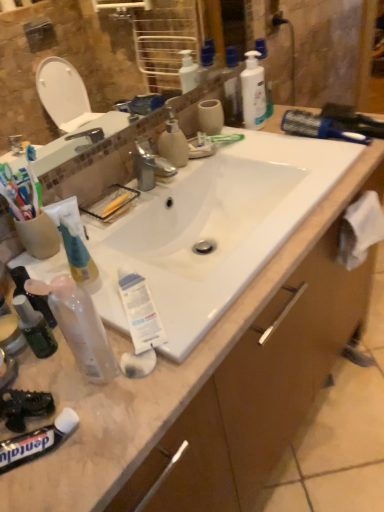
Identify the location of free point in front of transparent plastic spray bottle at lower left, positioned as the second toiletry in back-to-front order. This screenshot has height=512, width=384. (98, 436).